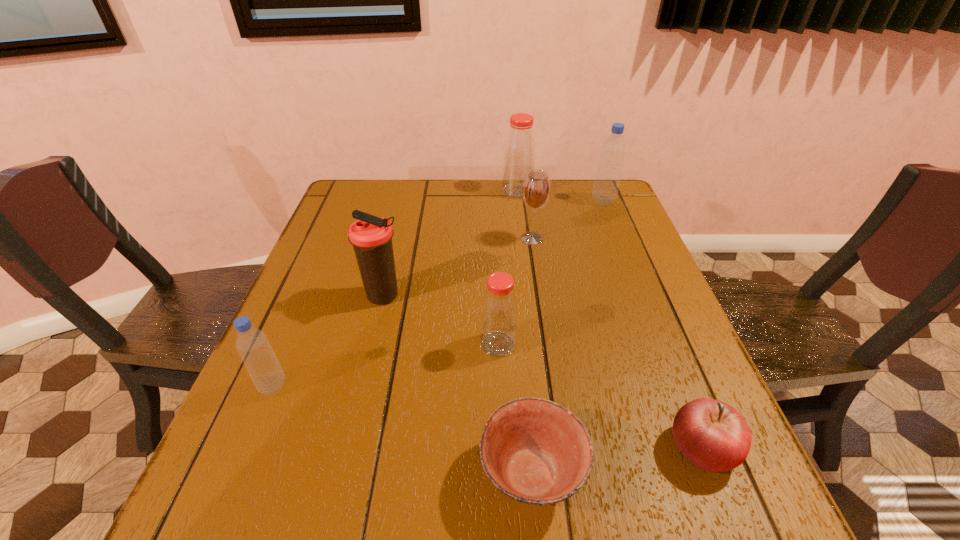
The width and height of the screenshot is (960, 540). Identify the location of the leftmost bottle. (252, 344).

Identify the location of apple. The height and width of the screenshot is (540, 960). (711, 434).

Identify the location of bowl. This screenshot has width=960, height=540. tap(535, 451).

You are a GUI agent. You are given a task and a screenshot of the screen. Output one action in this format:
    pyautogui.click(x=<x>, y=<y>)
    Task: Click on the free space located on the left of the bigger blue bottle
    This screenshot has width=960, height=540.
    Given the screenshot: What is the action you would take?
    pyautogui.click(x=559, y=201)

You are a GUI agent. You are given a task and a screenshot of the screen. Output one action in this format:
    pyautogui.click(x=<x>, y=<y>)
    Task: Click on the vacant region located on the front of the bigger red bottle
    
    Given the screenshot: What is the action you would take?
    pyautogui.click(x=521, y=224)

The height and width of the screenshot is (540, 960). Find the location of `free region located 0.230m on the front of the fourth farthest object`. free region located 0.230m on the front of the fourth farthest object is located at coordinates tap(358, 402).

The height and width of the screenshot is (540, 960). I want to click on vacant region located 0.050m on the front of the wineglass, so click(536, 258).

You are a GUI agent. You are given a task and a screenshot of the screen. Output one action in this format:
    pyautogui.click(x=<x>, y=<y>)
    Task: Click on the vacant space located on the back of the nearer red bottle
    This screenshot has width=960, height=540.
    Given the screenshot: What is the action you would take?
    pyautogui.click(x=494, y=254)

The image size is (960, 540). Find the location of `vacant space located on the front of the smaller blue bottle`. vacant space located on the front of the smaller blue bottle is located at coordinates (239, 467).

Where is `vacant space located 0.160m on the left of the apple`? This screenshot has height=540, width=960. vacant space located 0.160m on the left of the apple is located at coordinates (575, 448).